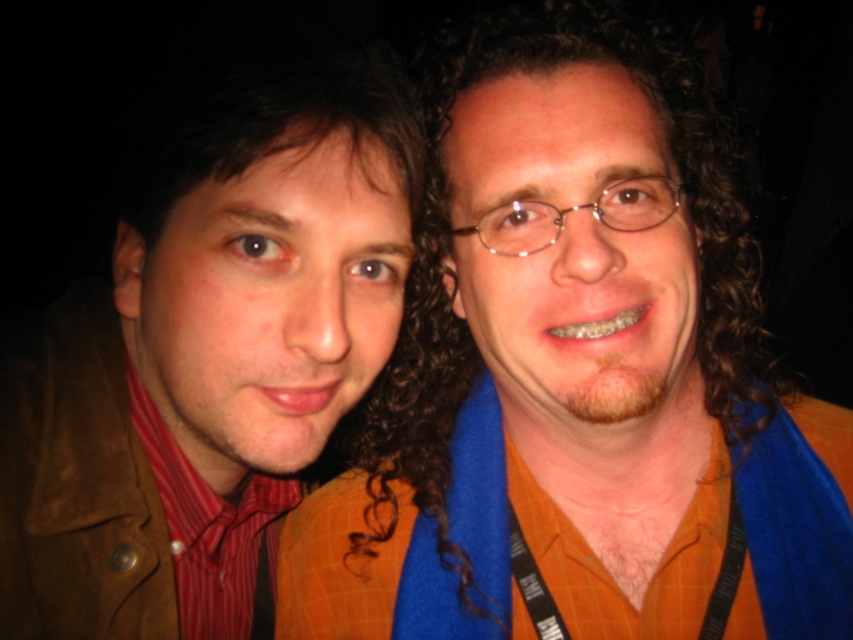
Question: Is orange checkered shirt at center to the right of matte brown jacket at left from the viewer's perspective?

Choices:
 (A) no
 (B) yes

Answer: (B)

Question: Does orange checkered shirt at center appear over red striped shirt at left?

Choices:
 (A) no
 (B) yes

Answer: (B)

Question: Does orange checkered shirt at center have a larger size compared to matte brown jacket at left?

Choices:
 (A) no
 (B) yes

Answer: (B)

Question: Which object appears closest to the camera in this image?

Choices:
 (A) red striped shirt at left
 (B) orange checkered shirt at center
 (C) matte brown jacket at left

Answer: (B)

Question: Among these objects, which one is farthest from the camera?

Choices:
 (A) red striped shirt at left
 (B) orange checkered shirt at center

Answer: (A)

Question: Which of the following is the farthest from the observer?

Choices:
 (A) (96, 548)
 (B) (428, 628)
 (C) (183, 493)

Answer: (C)